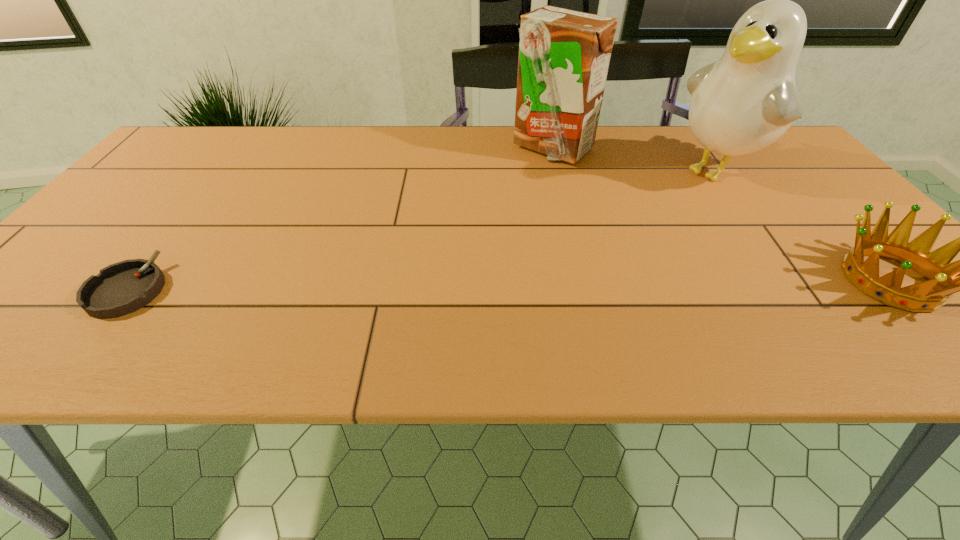
At what (x,y) coordinates should I click in order to perform the action: click on the closest object to the second shortest object. Please return your answer as a coordinate pair (x, y). Image resolution: width=960 pixels, height=540 pixels. Looking at the image, I should click on (742, 103).

This screenshot has width=960, height=540. What are the coordinates of `the third closest object to the third object from right to left` in the screenshot? It's located at (124, 287).

Find the location of a particular element. The image size is (960, 540). free space that satisfies the following two spatial constraints: 1. on the back side of the shortest object; 2. on the right side of the gull is located at coordinates (219, 171).